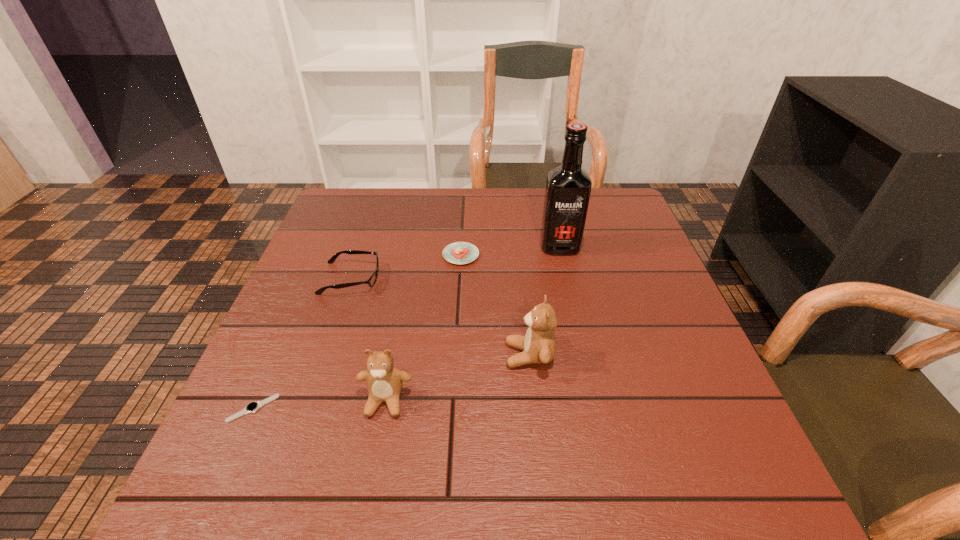
Identify the location of vacant space that satisfies the following two spatial constraints: 1. on the front-facing side of the liquor; 2. on the front-facing side of the second tallest object. (584, 355).

Image resolution: width=960 pixels, height=540 pixels. Find the location of `vacant space that satisfies the following two spatial constraints: 1. on the front-facing side of the rightmost object; 2. on the front-facing side of the third nearest object`. vacant space that satisfies the following two spatial constraints: 1. on the front-facing side of the rightmost object; 2. on the front-facing side of the third nearest object is located at coordinates (584, 355).

The image size is (960, 540). I want to click on free location that satisfies the following two spatial constraints: 1. on the front-facing side of the right teddy bear; 2. on the front side of the watch, so click(x=535, y=408).

I want to click on vacant space that satisfies the following two spatial constraints: 1. on the front-facing side of the tallest object; 2. on the front-facing side of the second tallest object, so click(584, 355).

The width and height of the screenshot is (960, 540). Find the location of `vacant space that satisfies the following two spatial constraints: 1. on the front-facing side of the rightmost object; 2. on the front-facing side of the right teddy bear`. vacant space that satisfies the following two spatial constraints: 1. on the front-facing side of the rightmost object; 2. on the front-facing side of the right teddy bear is located at coordinates (584, 355).

Find the location of a particular element. Image resolution: width=960 pixels, height=540 pixels. free spot that satisfies the following two spatial constraints: 1. on the front-facing side of the spectacles; 2. on the front side of the watch is located at coordinates (307, 408).

Image resolution: width=960 pixels, height=540 pixels. I want to click on free space in the image that satisfies the following two spatial constraints: 1. on the front-facing side of the liquor; 2. on the front-facing side of the spectacles, so click(x=566, y=279).